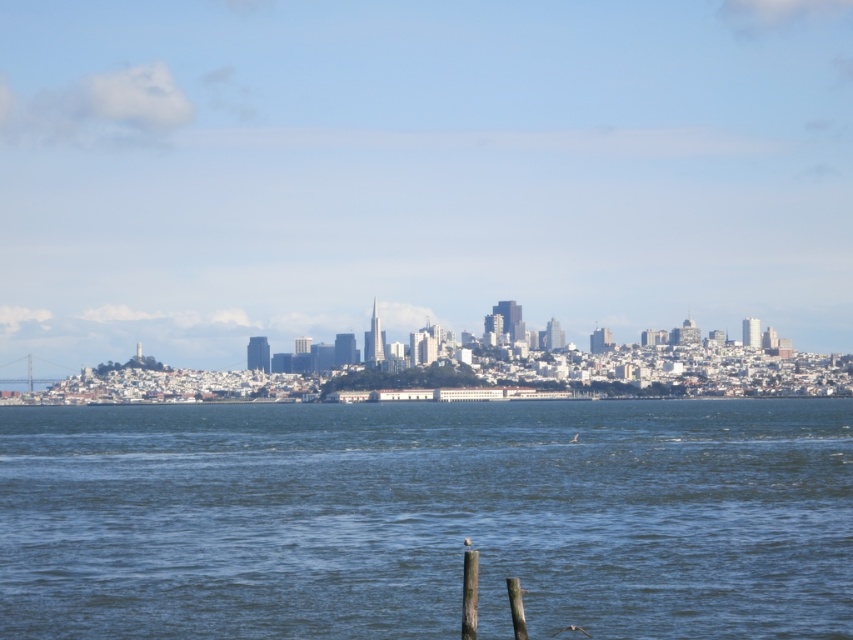
Can you confirm if blue water at center is positioned to the right of smooth wood post at lower center?

Indeed, blue water at center is positioned on the right side of smooth wood post at lower center.

Between blue water at center and smooth wood post at lower center, which one appears on the right side from the viewer's perspective?

blue water at center is more to the right.

Is point (83, 532) farther from viewer compared to point (466, 584)?

Yes, point (83, 532) is farther from viewer.

I want to click on blue water at center, so click(x=427, y=518).